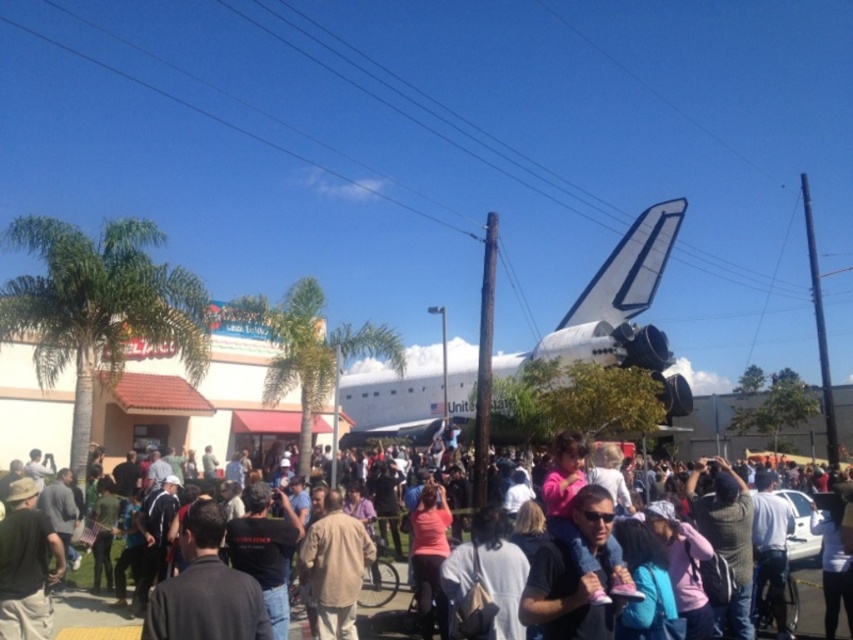
Question: Can you confirm if white matte space shuttle at center is thinner than beige fabric shirt at center?

Choices:
 (A) yes
 (B) no

Answer: (B)

Question: Which of these objects is positioned closest to the white matte space shuttle at center?

Choices:
 (A) matte black crowd at center
 (B) beige fabric shirt at center

Answer: (B)

Question: Which of these objects is positioned closest to the matte black crowd at center?

Choices:
 (A) beige fabric shirt at center
 (B) white matte space shuttle at center

Answer: (A)

Question: Which of the following is the farthest from the observer?

Choices:
 (A) pos(299,625)
 (B) pos(651,326)

Answer: (B)

Question: Is white matte space shuttle at center thinner than matte black crowd at center?

Choices:
 (A) no
 (B) yes

Answer: (B)

Question: Is white matte space shuttle at center below matte black crowd at center?

Choices:
 (A) yes
 (B) no

Answer: (B)